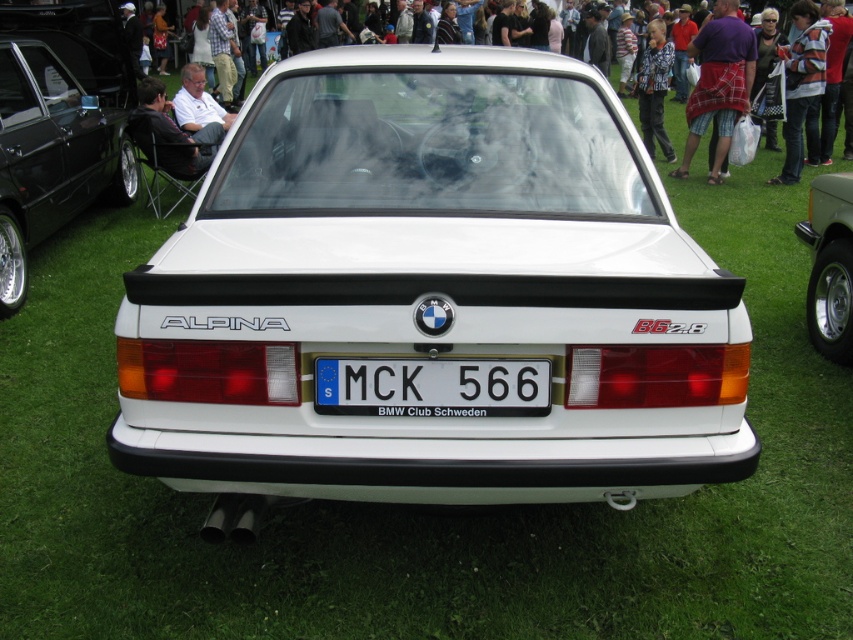
You are standing at the point marked by coordinates point (335, 401) and want to take a photo of the BMW Alpina B6 2.8. If your camera is 1.6 meters above the ground, how high should you set your tripod to ensure the camera is level with the car logo on the trunk lid?

The point marked by coordinates point (335, 401) and the camera are 2.58 meters apart. To ensure the camera is level with the car logo on the trunk lid, you should set the tripod height to 1.6 meters since the camera is already at that height above the ground.